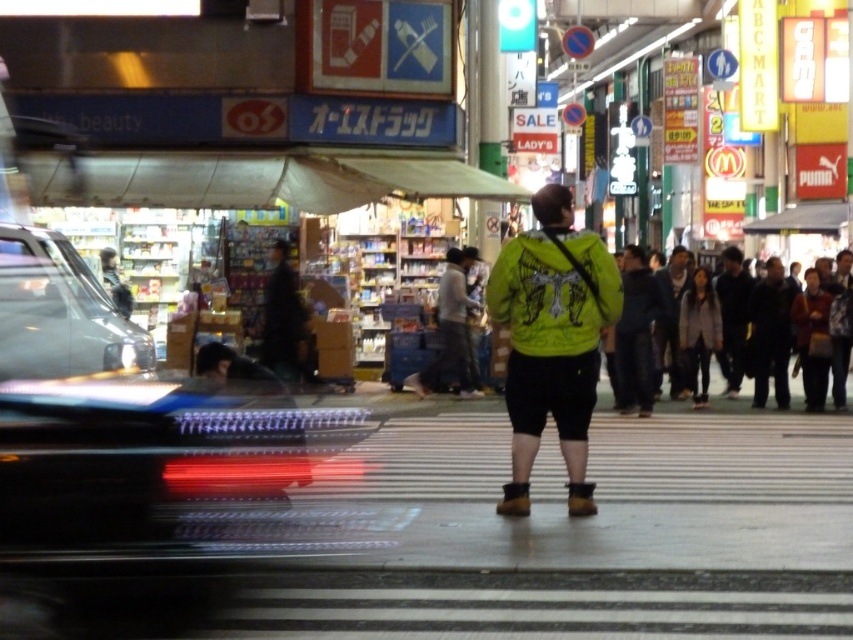
Question: Among these points, which one is farthest from the camera?

Choices:
 (A) pyautogui.click(x=669, y=330)
 (B) pyautogui.click(x=734, y=291)
 (C) pyautogui.click(x=663, y=324)
 (D) pyautogui.click(x=90, y=292)

Answer: (B)

Question: In this image, where is neon green jacket at center located relative to dark gray fabric crowd at right?

Choices:
 (A) left
 (B) right

Answer: (A)

Question: Which object is farther from the camera taking this photo?

Choices:
 (A) dark gray fabric jacket at right
 (B) dark blue jeans at center
 (C) shiny black car at left

Answer: (B)

Question: Is shiny black car at left positioned before dark gray fabric crowd at right?

Choices:
 (A) yes
 (B) no

Answer: (A)

Question: Does neon green jacket at center come in front of shiny black car at left?

Choices:
 (A) yes
 (B) no

Answer: (B)

Question: Which of the following is the closest to the observer?

Choices:
 (A) dark gray fabric crowd at right
 (B) shiny black car at left
 (C) dark gray fabric jacket at right

Answer: (B)